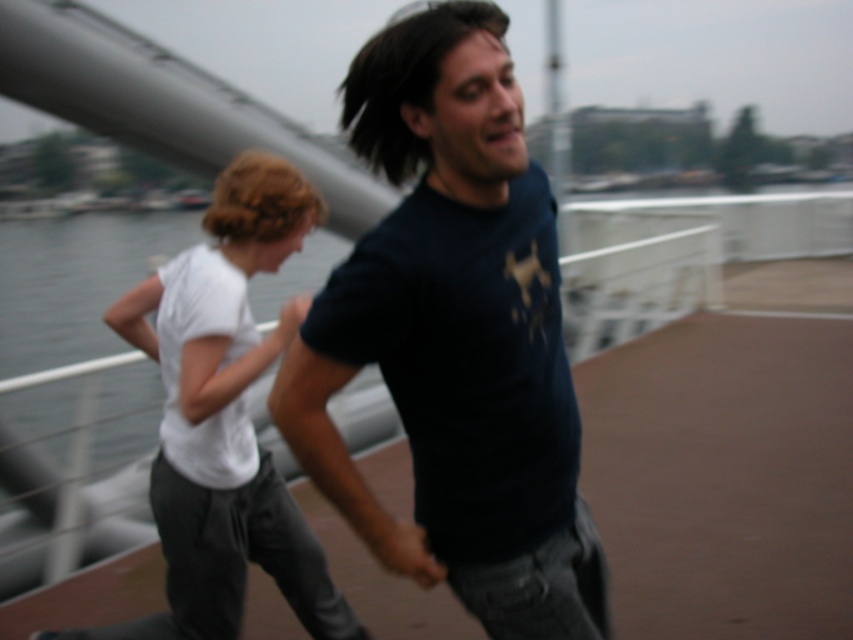
Is dark blue t-shirt at center further to the viewer compared to white cotton shirt at center?

No, it is in front of white cotton shirt at center.

What do you see at coordinates (456, 339) in the screenshot?
I see `dark blue t-shirt at center` at bounding box center [456, 339].

Is point (496, 173) more distant than point (296, 182)?

No, (496, 173) is closer to viewer.

Locate an element on the screen. Image resolution: width=853 pixels, height=640 pixels. dark blue t-shirt at center is located at coordinates (456, 339).